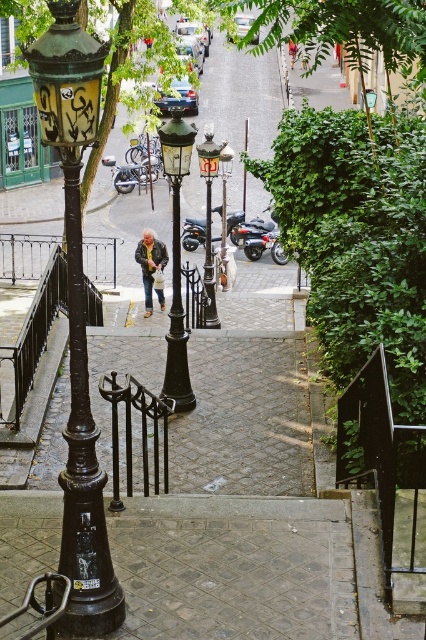
Question: Does black metal/rail at lower left have a larger size compared to black glass street light at center?

Choices:
 (A) yes
 (B) no

Answer: (B)

Question: Is polished brass streetlight at center to the left of leather jacket at center from the viewer's perspective?

Choices:
 (A) no
 (B) yes

Answer: (A)

Question: Does green glass street light at center have a larger size compared to polished brass streetlight at center?

Choices:
 (A) no
 (B) yes

Answer: (A)

Question: Which is farther from the black metal/rail at lower left?

Choices:
 (A) green glass street light at center
 (B) black wrought iron rail at center
 (C) leather jacket at center

Answer: (A)

Question: Among these objects, which one is farthest from the camera?

Choices:
 (A) black wrought iron rail at center
 (B) black metal rail at lower left
 (C) polished brass streetlight at center
 (D) black glass street light at center

Answer: (D)

Question: Which object is positioned farthest from the leather jacket at center?

Choices:
 (A) orange fabric shirt at center
 (B) black metal rail at lower left
 (C) black wrought iron rail at center

Answer: (B)